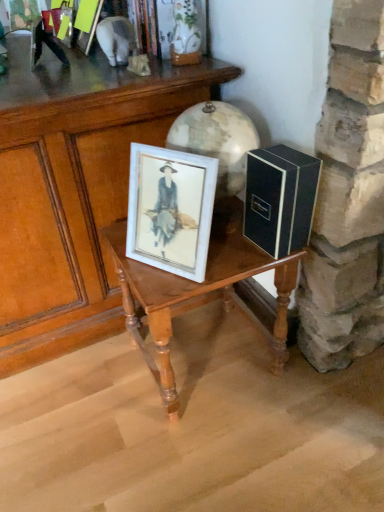
Describe the element at coordinates (33, 29) in the screenshot. The image size is (384, 512). I see `metallic silver figurine at upper left` at that location.

Measure the distance between wooden table at center, which is the second table in right-to-left order, and camera.

A distance of 35.76 inches exists between wooden table at center, which is the second table in right-to-left order, and camera.

This screenshot has height=512, width=384. I want to click on wooden table at center, which is the second table in right-to-left order, so click(73, 189).

Identify the location of metallic silver figurine at upper left. [x=33, y=29].

At what (x,y) coordinates should I click in order to perform the action: click on table above the wooden table at center, marked as the first table in a right-to-left arrangement (from a real-world perspective). Please return your answer as a coordinate pair (x, y). Looking at the image, I should click on (73, 189).

From the image's perspective, is wooden table at center, which ranks as the 2th table in left-to-right order, below wooden table at center, which is counted as the 1th table, starting from the left?

Yes, from the image's perspective, wooden table at center, which ranks as the 2th table in left-to-right order, is below wooden table at center, which is counted as the 1th table, starting from the left.

Is wooden table at center, marked as the first table in a right-to-left arrangement, aimed at wooden table at center, which is the second table in right-to-left order?

No, wooden table at center, marked as the first table in a right-to-left arrangement, is not facing towards wooden table at center, which is the second table in right-to-left order.

Based on the photo, does wooden table at center, which ranks as the 2th table in left-to-right order, have a greater width compared to wooden table at center, which is counted as the 1th table, starting from the left?

No, wooden table at center, which ranks as the 2th table in left-to-right order, is not wider than wooden table at center, which is counted as the 1th table, starting from the left.

Does point (266, 250) appear closer or farther from the camera than point (101, 221)?

Point (266, 250).

From the picture: Considering the sizes of objects black matte box at right and wooden table at center, which is the second table in right-to-left order, in the image provided, who is bigger, black matte box at right or wooden table at center, which is the second table in right-to-left order,?

With larger size is wooden table at center, which is the second table in right-to-left order.

From the image's perspective, is black matte box at right over wooden table at center, which is counted as the 1th table, starting from the left?

No, from the image's perspective, black matte box at right is not on top of wooden table at center, which is counted as the 1th table, starting from the left.

Is black matte box at right facing away from wooden table at center, which is counted as the 1th table, starting from the left?

No, black matte box at right is not facing away from wooden table at center, which is counted as the 1th table, starting from the left.

From the picture: From a real-world perspective, which is physically above, wooden table at center, which ranks as the 2th table in left-to-right order, or white matte picture frame at center?

From a 3D spatial view, white matte picture frame at center is above.

Is wooden table at center, marked as the first table in a right-to-left arrangement, wider or thinner than white matte picture frame at center?

In the image, wooden table at center, marked as the first table in a right-to-left arrangement, appears to be wider than white matte picture frame at center.

Is white matte picture frame at center at the back of wooden table at center, marked as the first table in a right-to-left arrangement?

No, wooden table at center, marked as the first table in a right-to-left arrangement, is not facing away from white matte picture frame at center.

Based on the photo, from the image's perspective, is white matte picture frame at center located beneath metallic silver figurine at upper left?

Indeed, from the image's perspective, white matte picture frame at center is shown beneath metallic silver figurine at upper left.

Looking at this image, which is nearer, (142, 197) or (36, 33)?

The point (142, 197) is closer to the camera.

Is white matte picture frame at center taller or shorter than metallic silver figurine at upper left?

Clearly, white matte picture frame at center is taller compared to metallic silver figurine at upper left.

Is metallic silver figurine at upper left positioned beyond the bounds of white matte picture frame at center?

Yes, metallic silver figurine at upper left is outside of white matte picture frame at center.

From the image's perspective, is metallic silver figurine at upper left on top of white matte picture frame at center?

Indeed, from the image's perspective, metallic silver figurine at upper left is shown above white matte picture frame at center.

Does metallic silver figurine at upper left have a larger size compared to white matte picture frame at center?

Actually, metallic silver figurine at upper left might be smaller than white matte picture frame at center.

This screenshot has width=384, height=512. In order to click on couple above the white matte picture frame at center (from a real-world perspective) in this screenshot , I will do `click(33, 29)`.

Would you consider white matte picture frame at center to be distant from black matte box at right?

They are positioned close to each other.

From the image's perspective, is white matte picture frame at center located above black matte box at right?

No, from the image's perspective, white matte picture frame at center is not over black matte box at right.

Could you tell me if white matte picture frame at center is facing black matte box at right?

No.

The image size is (384, 512). In the image, there is a white matte picture frame at center. What are the coordinates of `book below it (from a real-world perspective)` in the screenshot? It's located at (280, 199).

From a real-world perspective, is metallic silver figurine at upper left positioned above or below wooden table at center, which is the second table in right-to-left order?

In terms of real-world spatial position, metallic silver figurine at upper left is above wooden table at center, which is the second table in right-to-left order.

From the image's perspective, is metallic silver figurine at upper left on top of wooden table at center, which is the second table in right-to-left order?

Yes.

Based on the photo, is metallic silver figurine at upper left beside wooden table at center, which is the second table in right-to-left order?

No.

At what (x,y) coordinates should I click in order to perform the action: click on table in front of the wooden table at center, which ranks as the 2th table in left-to-right order. Please return your answer as a coordinate pair (x, y). Looking at the image, I should click on (73, 189).

This screenshot has height=512, width=384. In order to click on table that is the 2nd object to the left of the black matte box at right, starting at the anchor in this screenshot , I will do `click(73, 189)`.

When comparing their distances from black matte box at right, does wooden table at center, which ranks as the 2th table in left-to-right order, or metallic silver figurine at upper left seem closer?

wooden table at center, which ranks as the 2th table in left-to-right order.

Estimate the real-world distances between objects in this image. Which object is further from wooden table at center, which is counted as the 1th table, starting from the left, wooden table at center, marked as the first table in a right-to-left arrangement, or metallic silver figurine at upper left?

The object further to wooden table at center, which is counted as the 1th table, starting from the left, is metallic silver figurine at upper left.

Based on their spatial positions, is white matte picture frame at center or wooden table at center, marked as the first table in a right-to-left arrangement, further from black matte box at right?

white matte picture frame at center is further to black matte box at right.

When comparing their distances from wooden table at center, marked as the first table in a right-to-left arrangement, does wooden table at center, which is counted as the 1th table, starting from the left, or black matte box at right seem closer?

black matte box at right is positioned closer to the anchor wooden table at center, marked as the first table in a right-to-left arrangement.

Considering their positions, is metallic silver figurine at upper left positioned further to white matte picture frame at center than wooden table at center, which ranks as the 2th table in left-to-right order?

The object further to white matte picture frame at center is metallic silver figurine at upper left.

Based on their spatial positions, is black matte box at right or wooden table at center, marked as the first table in a right-to-left arrangement, closer to white matte picture frame at center?

wooden table at center, marked as the first table in a right-to-left arrangement, is positioned closer to the anchor white matte picture frame at center.

In the scene shown: Which object lies further to the anchor point wooden table at center, marked as the first table in a right-to-left arrangement, metallic silver figurine at upper left or wooden table at center, which is the second table in right-to-left order?

metallic silver figurine at upper left is positioned further to the anchor wooden table at center, marked as the first table in a right-to-left arrangement.

Based on their spatial positions, is metallic silver figurine at upper left or white matte picture frame at center further from black matte box at right?

metallic silver figurine at upper left is further to black matte box at right.

What are the coordinates of `table between metallic silver figurine at upper left and wooden table at center, which ranks as the 2th table in left-to-right order, in the vertical direction` in the screenshot? It's located at (73, 189).

The image size is (384, 512). I want to click on picture frame between metallic silver figurine at upper left and wooden table at center, which ranks as the 2th table in left-to-right order, in the vertical direction, so click(170, 209).

At what (x,y) coordinates should I click in order to perform the action: click on book that lies between metallic silver figurine at upper left and wooden table at center, marked as the first table in a right-to-left arrangement, from top to bottom. Please return your answer as a coordinate pair (x, y). Looking at the image, I should click on (280, 199).

You are a GUI agent. You are given a task and a screenshot of the screen. Output one action in this format:
    pyautogui.click(x=<x>, y=<y>)
    Task: Click on the table between metallic silver figurine at upper left and white matte picture frame at center in the vertical direction
    Image resolution: width=384 pixels, height=512 pixels.
    Given the screenshot: What is the action you would take?
    pyautogui.click(x=73, y=189)